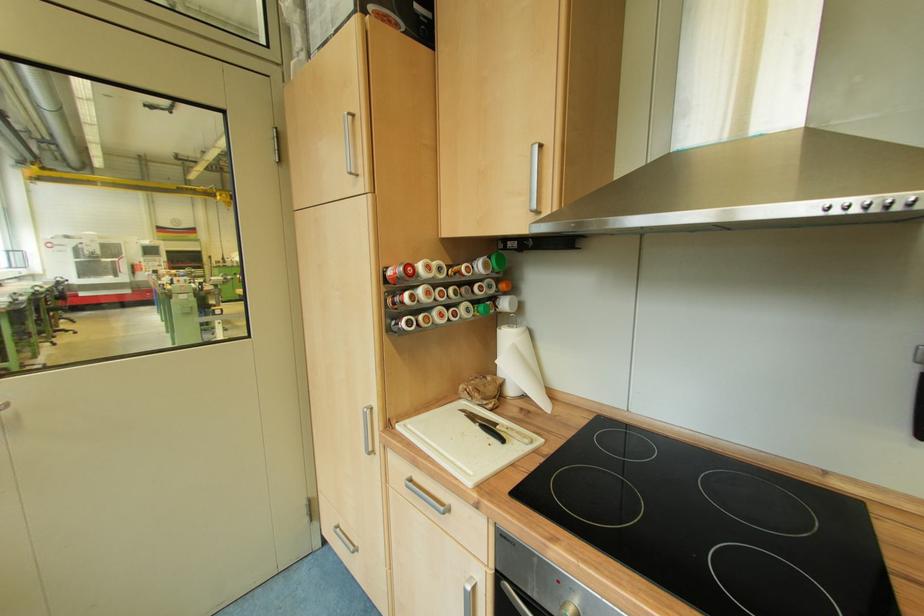
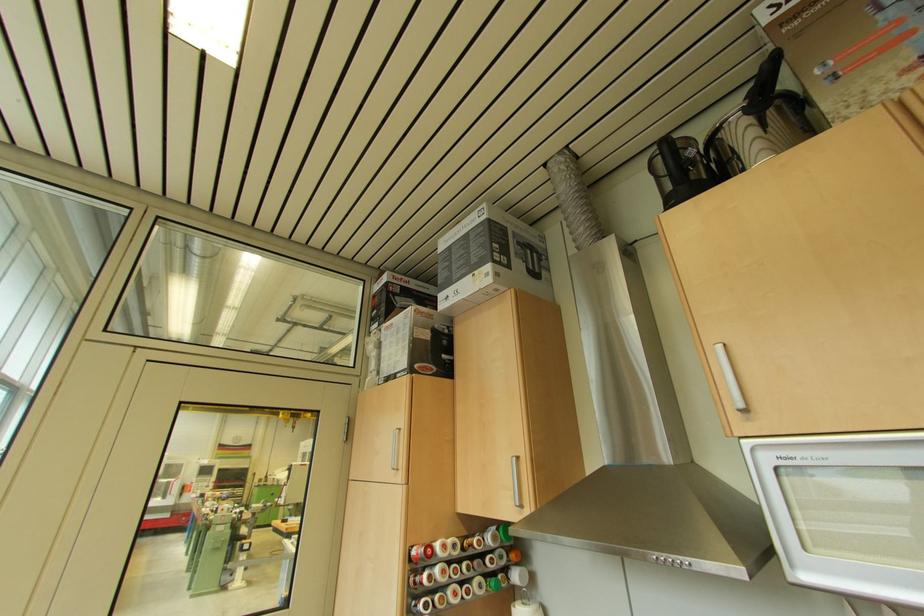
Where in the second image is the point corresponding to the point at 454,236 from the first image?

(468, 513)